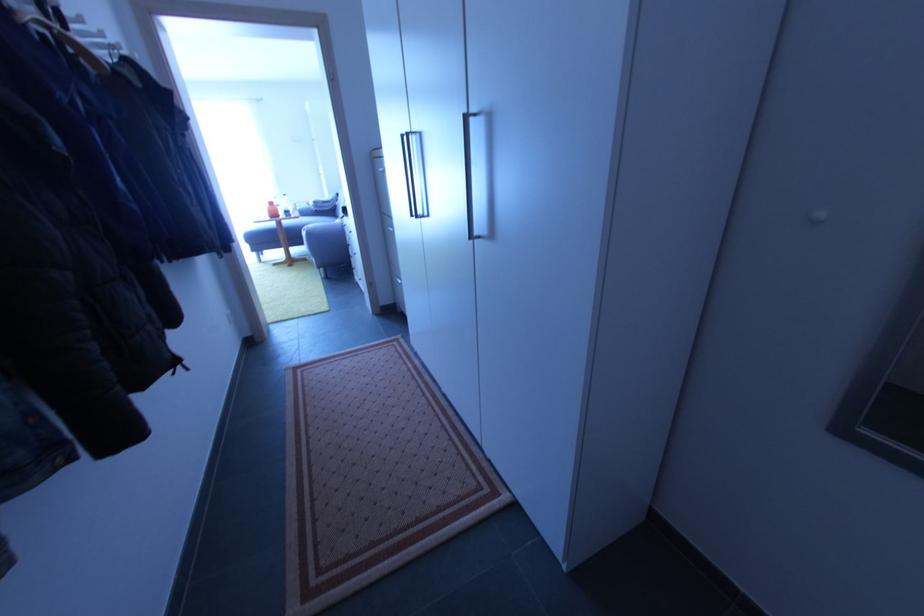
This screenshot has height=616, width=924. Describe the element at coordinates (281, 233) in the screenshot. I see `the sofa sitting surface` at that location.